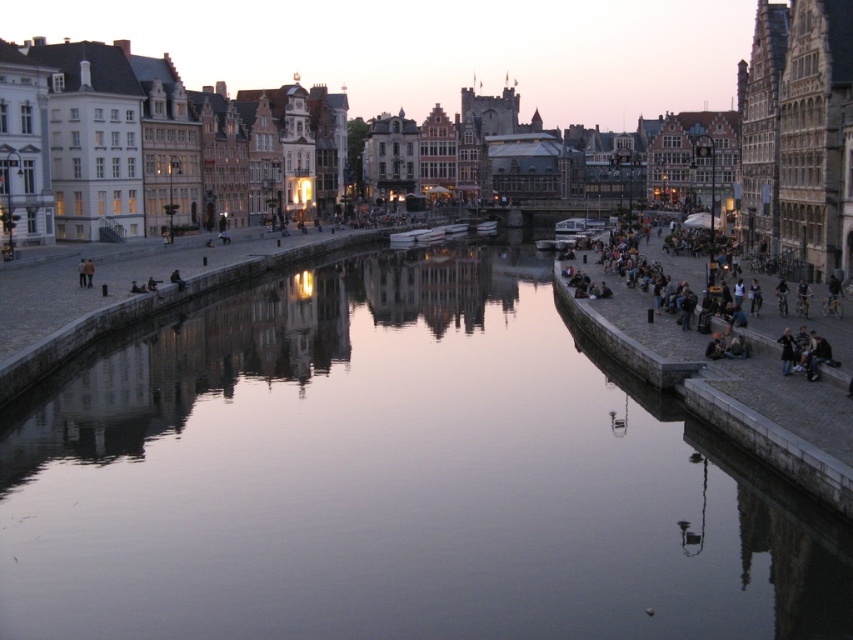
Who is lower down, smooth water at center or dark blue jeans at lower right?

smooth water at center is below.

Based on the photo, who is more forward, (108,467) or (784,364)?

Positioned in front is point (108,467).

At what (x,y) coordinates should I click in order to perform the action: click on smooth water at center. Please return your answer as a coordinate pair (x, y). Looking at the image, I should click on (393, 476).

Between smooth water at center and dark gray stone people at right, which one has more height?

Standing taller between the two is smooth water at center.

Can you confirm if smooth water at center is positioned below dark gray stone people at right?

Yes, smooth water at center is below dark gray stone people at right.

The width and height of the screenshot is (853, 640). Identify the location of smooth water at center. (393, 476).

Which is more to the right, dark gray stone people at right or dark blue jeans at lower right?

From the viewer's perspective, dark blue jeans at lower right appears more on the right side.

Does dark gray stone people at right have a greater width compared to dark blue jeans at lower right?

Yes, dark gray stone people at right is wider than dark blue jeans at lower right.

In the scene shown: Who is more forward, (688,372) or (787,349)?

Positioned in front is point (787,349).

Locate an element on the screen. The width and height of the screenshot is (853, 640). dark gray stone people at right is located at coordinates (636, 333).